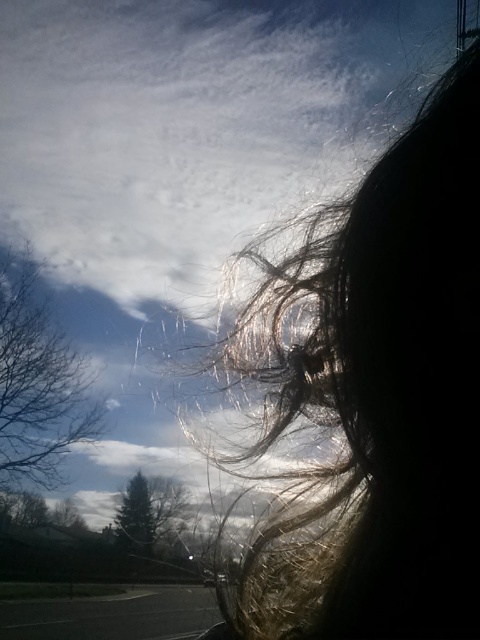
Does point (256, 385) come closer to viewer compared to point (25, 326)?

Yes, it is.

Does silky brown hair at upper right have a larger size compared to bare branches at left?

Actually, silky brown hair at upper right might be smaller than bare branches at left.

Is point (475, 182) positioned behind point (1, 285)?

No, (475, 182) is closer to viewer.

You are a GUI agent. You are given a task and a screenshot of the screen. Output one action in this format:
    pyautogui.click(x=<x>, y=<y>)
    Task: Click on the silky brown hair at upper right
    Image resolution: width=480 pixels, height=640 pixels.
    Given the screenshot: What is the action you would take?
    pyautogui.click(x=359, y=401)

Between bare branches at left and green matte tree at lower left, which one has less height?

green matte tree at lower left

Which is behind, point (22, 298) or point (139, 536)?

Point (139, 536)

Find the location of a particular element. Image resolution: width=480 pixels, height=640 pixels. bare branches at left is located at coordinates (37, 380).

Does silky brown hair at upper right have a greater height compared to green matte tree at lower left?

No, silky brown hair at upper right is not taller than green matte tree at lower left.

You are a GUI agent. You are given a task and a screenshot of the screen. Output one action in this format:
    pyautogui.click(x=<x>, y=<y>)
    Task: Click on the silky brown hair at upper right
    The image size is (480, 640).
    Given the screenshot: What is the action you would take?
    coord(359,401)

You are a GUI agent. You are given a task and a screenshot of the screen. Output one action in this format:
    pyautogui.click(x=<x>, y=<y>)
    Task: Click on the silky brown hair at upper right
    Image resolution: width=480 pixels, height=640 pixels.
    Given the screenshot: What is the action you would take?
    pyautogui.click(x=359, y=401)